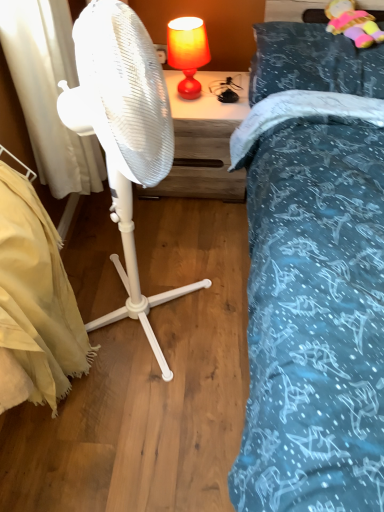
Question: Is white plastic fan at center to the right of matte orange lampshade at upper center from the viewer's perspective?

Choices:
 (A) yes
 (B) no

Answer: (B)

Question: Can you confirm if white plastic fan at center is shorter than matte orange lampshade at upper center?

Choices:
 (A) yes
 (B) no

Answer: (B)

Question: Is white plastic fan at center oriented away from matte orange lampshade at upper center?

Choices:
 (A) yes
 (B) no

Answer: (B)

Question: From the image's perspective, is white plastic fan at center located above matte orange lampshade at upper center?

Choices:
 (A) yes
 (B) no

Answer: (B)

Question: From a real-world perspective, is white plastic fan at center beneath matte orange lampshade at upper center?

Choices:
 (A) yes
 (B) no

Answer: (A)

Question: In terms of width, does matte orange lampshade at upper center look wider or thinner when compared to beige fabric mattress at lower left?

Choices:
 (A) wide
 (B) thin

Answer: (B)

Question: Considering their positions, is matte orange lampshade at upper center located in front of or behind beige fabric mattress at lower left?

Choices:
 (A) behind
 (B) front

Answer: (A)

Question: Considering the relative positions of matte orange lampshade at upper center and beige fabric mattress at lower left in the image provided, is matte orange lampshade at upper center to the left or to the right of beige fabric mattress at lower left?

Choices:
 (A) left
 (B) right

Answer: (B)

Question: From the image's perspective, is matte orange lampshade at upper center located above or below beige fabric mattress at lower left?

Choices:
 (A) above
 (B) below

Answer: (A)

Question: Is point (71, 350) positioned closer to the camera than point (69, 173)?

Choices:
 (A) farther
 (B) closer

Answer: (B)

Question: Do you think beige fabric mattress at lower left is within white fabric curtain at left, or outside of it?

Choices:
 (A) outside
 (B) inside

Answer: (A)

Question: From a real-world perspective, relative to white fabric curtain at left, is beige fabric mattress at lower left vertically above or below?

Choices:
 (A) below
 (B) above

Answer: (A)

Question: Considering the positions of beige fabric mattress at lower left and white fabric curtain at left in the image, is beige fabric mattress at lower left wider or thinner than white fabric curtain at left?

Choices:
 (A) wide
 (B) thin

Answer: (A)

Question: Is white fabric curtain at left to the left or to the right of beige fabric mattress at lower left in the image?

Choices:
 (A) right
 (B) left

Answer: (A)

Question: Is point (66, 7) positioned closer to the camera than point (1, 369)?

Choices:
 (A) closer
 (B) farther

Answer: (B)